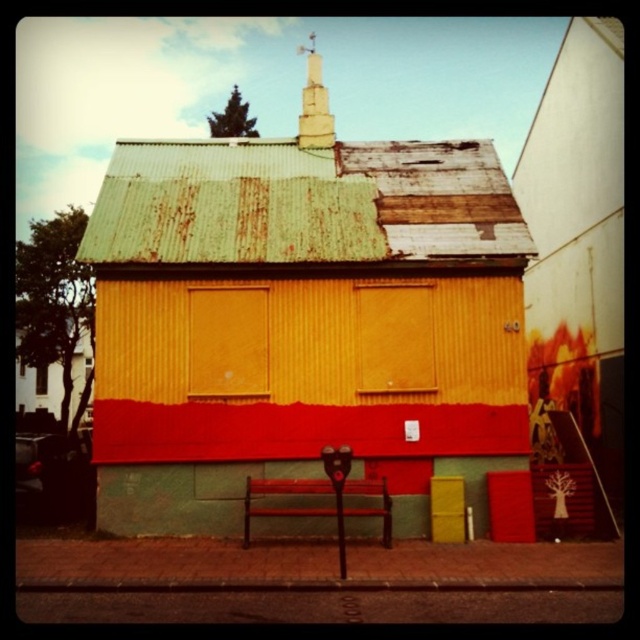
You are standing in front of the building and want to take a photo of both the rusty corrugated metal church at center and the smooth white spire at upper center. Which object should you adjust your camera to focus on first if you want to capture both in the frame?

The rusty corrugated metal church at center is to the left of the smooth white spire at upper center. To capture both in the frame, focus on the rusty corrugated metal church at center first as it is positioned to the left, allowing the spire to be included on the right side of the frame.

You are standing in front of the building and want to install a new antenna on the tallest point. Which object should you choose between the rusty corrugated metal church at center and the smooth white spire at upper center?

The smooth white spire at upper center is taller than the rusty corrugated metal church at center, so you should install the antenna on the smooth white spire at upper center.

You are standing in front of a building and see a point at coordinates (301,323). According to the image, what object is located at that point?

The point at coordinates (301,323) corresponds to the rusty corrugated metal church at center.